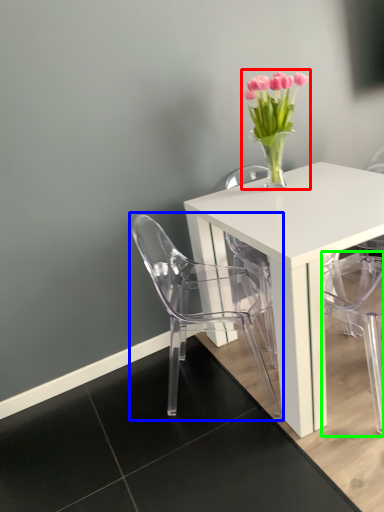
Question: Which is farther away from floral arrangement (highlighted by a red box)? chair (highlighted by a blue box) or armchair (highlighted by a green box)?

Choices:
 (A) chair
 (B) armchair

Answer: (B)